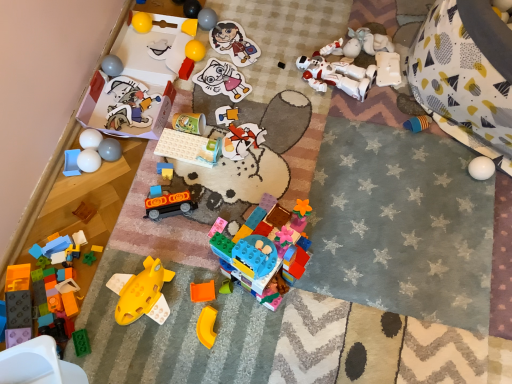
I want to click on unoccupied region to the right of yellow matte plastic piece at center, the seventh toy when ordered from right to left, so click(x=263, y=332).